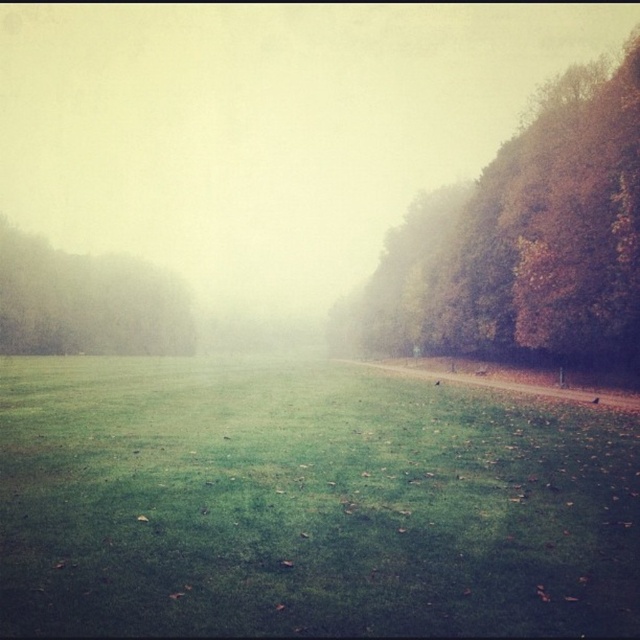
You are planning to set up a picnic blanket in the green grassy field at center. Considering the green matte tree at left is partially obscured by mist, can you determine if the field is wide enough to accommodate a picnic blanket that requires 10 meters of space?

The green grassy field at center might be wider than green matte tree at left, but the exact width isn not specified. Without precise measurements, it is uncertain if the field is wide enough for a 10 meter picnic blanket.

You are a hiker trying to cross the field. You notice the autumn leaves at right and the green matte tree at left. Which object would block your path more if you were to walk towards the center of the field?

The autumn leaves at right would block your path more because they are larger in size than the green matte tree at left.

You are a hiker trying to cross the green grassy field at center and autumn leaves at right. Which area would you choose to walk through if you prefer a path with shorter vegetation?

The green grassy field at center is not as tall as autumn leaves at right, so you should choose the green grassy field at center for a shorter vegetation path.